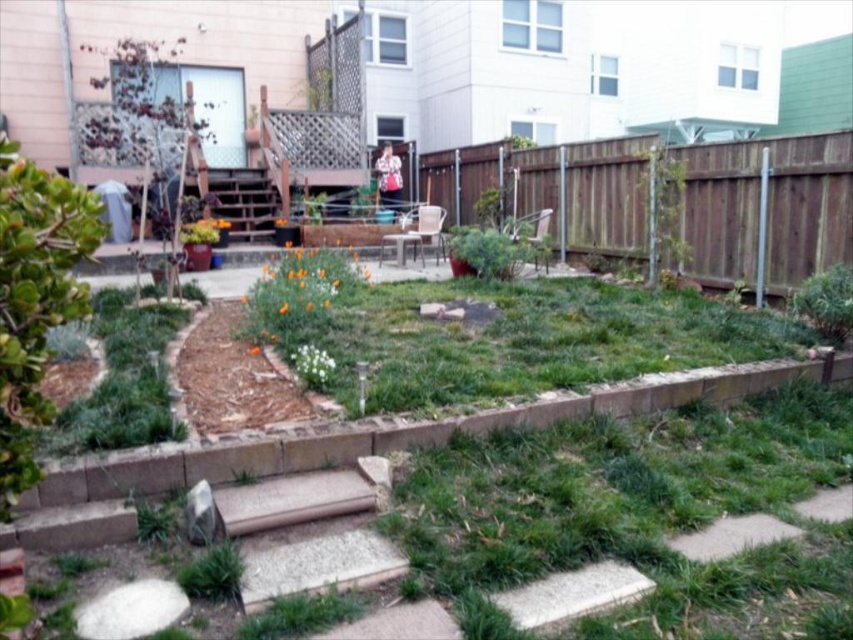
Is brown wooden fence at center wider than green leafy plant at upper right?

Yes, brown wooden fence at center is wider than green leafy plant at upper right.

Can you confirm if brown wooden fence at center is shorter than green leafy plant at upper right?

In fact, brown wooden fence at center may be taller than green leafy plant at upper right.

Locate an element on the screen. The height and width of the screenshot is (640, 853). brown wooden fence at center is located at coordinates (755, 209).

Can you confirm if brown wooden fence at center is bigger than brown wood stair at lower center?

Result: Yes, brown wooden fence at center is bigger than brown wood stair at lower center.

Can you confirm if brown wooden fence at center is positioned below brown wood stair at lower center?

Incorrect, brown wooden fence at center is not positioned below brown wood stair at lower center.

Is point (735, 166) farther from viewer compared to point (264, 486)?

Yes.

You are a GUI agent. You are given a task and a screenshot of the screen. Output one action in this format:
    pyautogui.click(x=<x>, y=<y>)
    Task: Click on the brown wooden fence at center
    The image size is (853, 640).
    Given the screenshot: What is the action you would take?
    pyautogui.click(x=755, y=209)

From the picture: Can you confirm if brown wood stair at lower center is thinner than green leafy plant at upper right?

Incorrect, brown wood stair at lower center's width is not less than green leafy plant at upper right's.

Where is `brown wood stair at lower center`? This screenshot has width=853, height=640. brown wood stair at lower center is located at coordinates (305, 534).